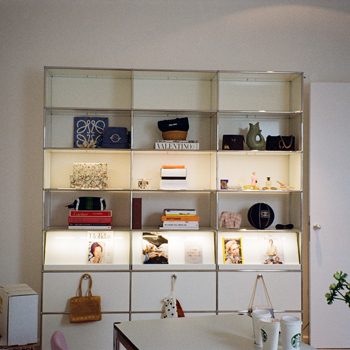
The image size is (350, 350). In order to click on book in this screenshot , I will do `click(190, 224)`.